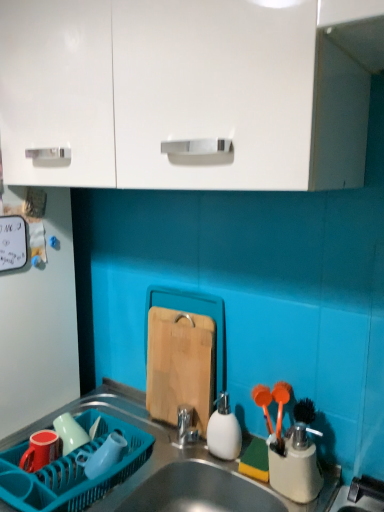
Identify the location of unoccupied region to the right of matte green cup at left, which is the third tableware in right-to-left order. (130, 446).